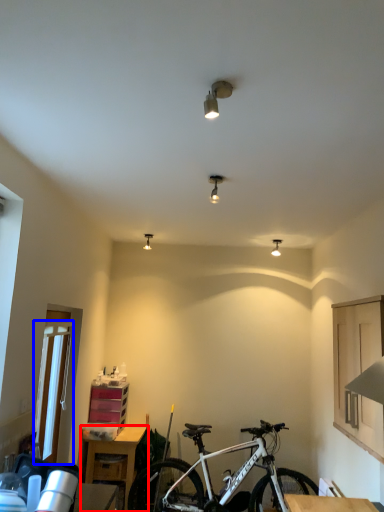
Question: Which object appears closest to the camera in this image, table (highlighted by a red box) or glass door (highlighted by a blue box)?

Choices:
 (A) table
 (B) glass door

Answer: (B)